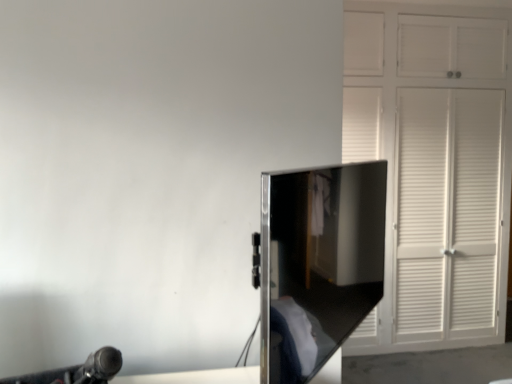
This screenshot has width=512, height=384. In order to click on black glossy screen door at center in this screenshot , I will do `click(318, 263)`.

Describe the element at coordinates (318, 263) in the screenshot. I see `black glossy screen door at center` at that location.

You are a GUI agent. You are given a task and a screenshot of the screen. Output one action in this format:
    pyautogui.click(x=<x>, y=<y>)
    Task: Click on the black glossy screen door at center
    This screenshot has height=384, width=512.
    Given the screenshot: What is the action you would take?
    pyautogui.click(x=318, y=263)